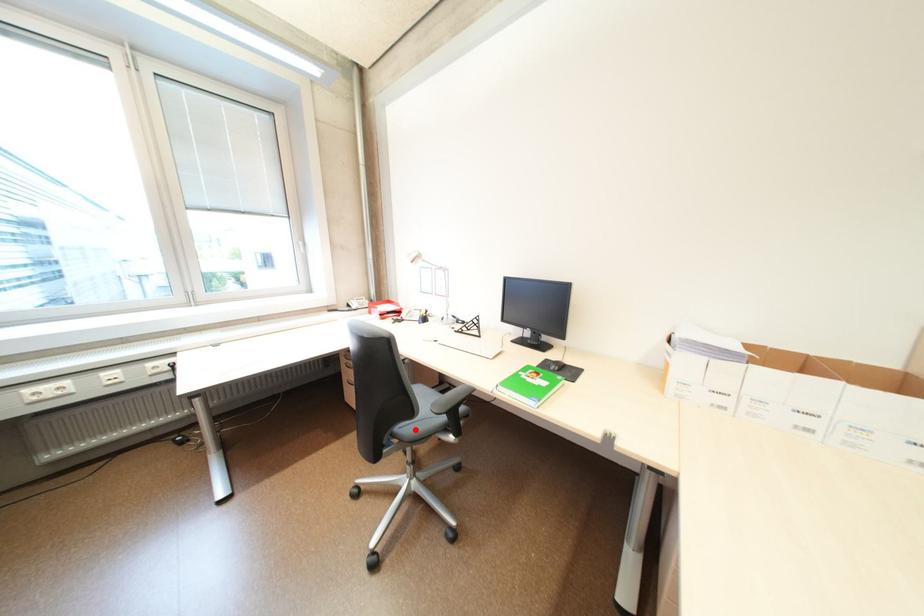
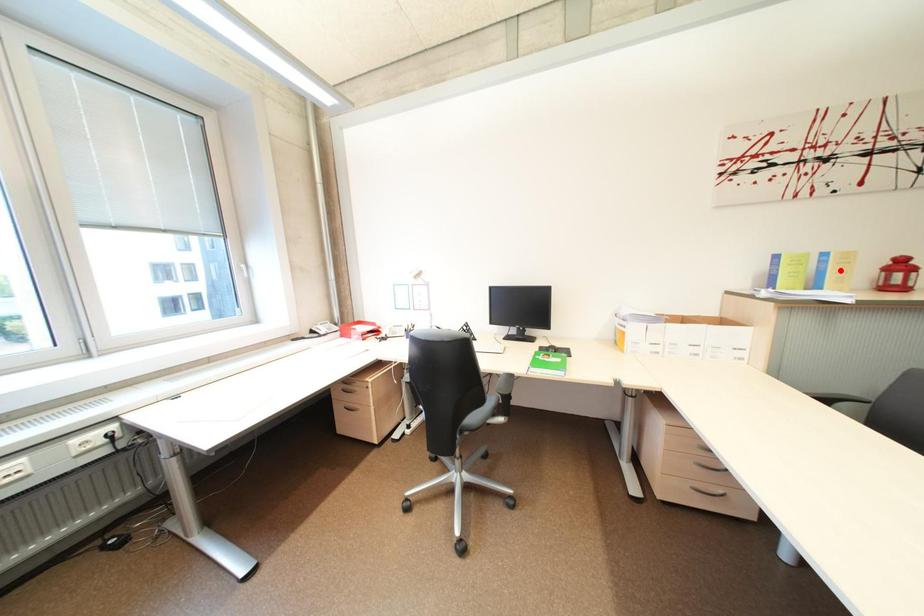
I am providing you with two images of the same scene from different viewpoints. A red point is marked on the first image and another point is marked on the second image. Do the highlighted points in image1 and image2 indicate the same real-world spot?

No